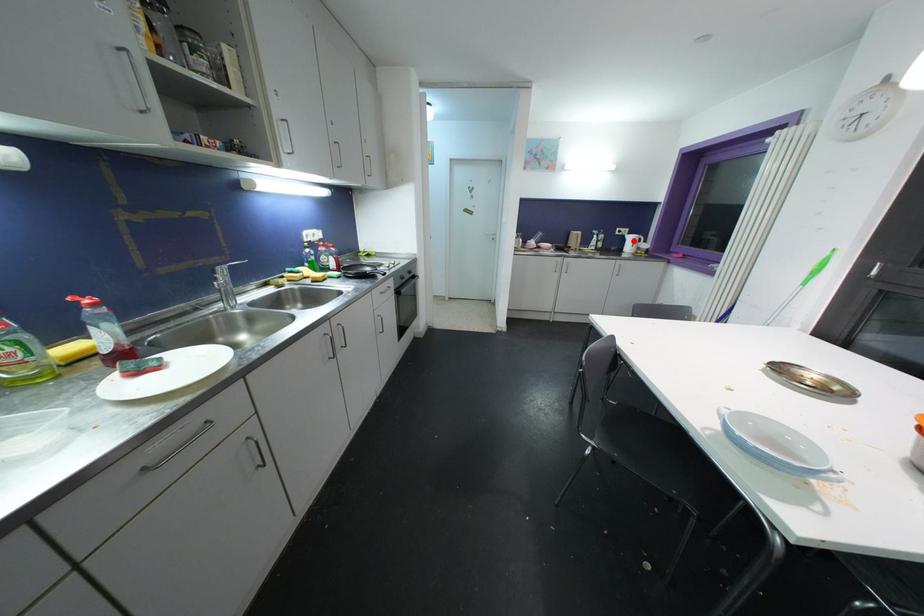
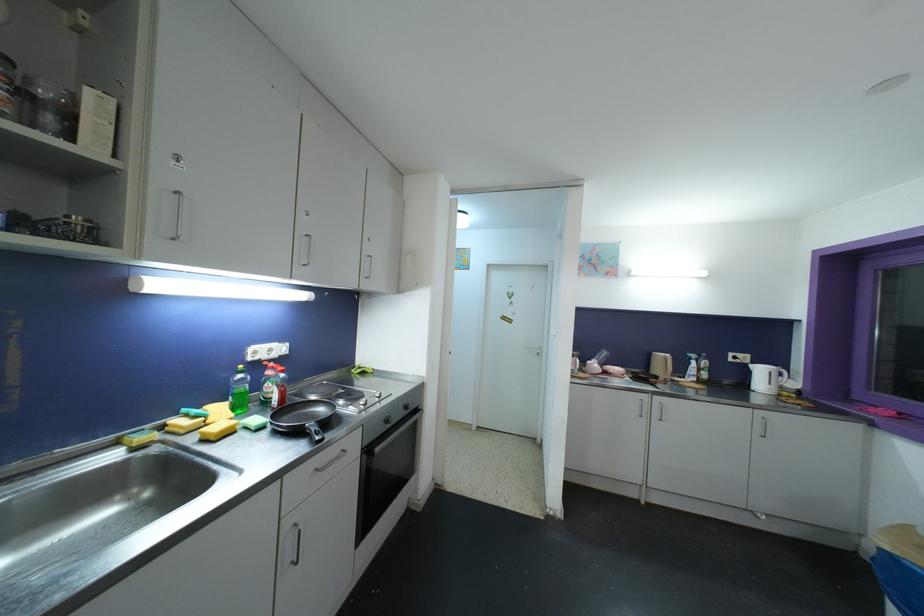
In the second image, find the point that corresponds to the highlighted location in the first image.

(763, 373)